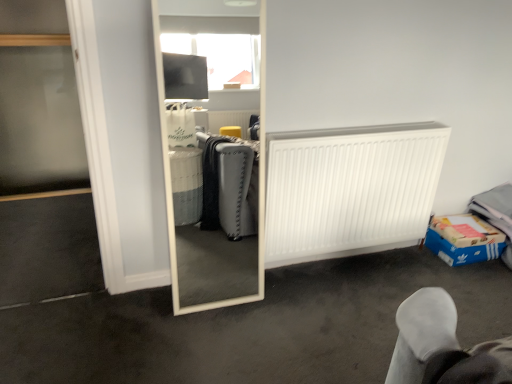
The width and height of the screenshot is (512, 384). In order to click on blue cardboard box at lower right in this screenshot , I will do `click(464, 239)`.

I want to click on white matte mirror at center, so click(252, 327).

Identify the location of white matte radiator at center right. The height and width of the screenshot is (384, 512). (350, 190).

This screenshot has height=384, width=512. Describe the element at coordinates (350, 190) in the screenshot. I see `white matte radiator at center right` at that location.

The width and height of the screenshot is (512, 384). I want to click on blue cardboard box at lower right, so click(464, 239).

Which of these two, blue cardboard box at lower right or white matte mirror at center, is bigger?

Bigger between the two is white matte mirror at center.

From a real-world perspective, between blue cardboard box at lower right and white matte mirror at center, who is vertically lower?

white matte mirror at center.

Is blue cardboard box at lower right shorter than white matte mirror at center?

Incorrect, the height of blue cardboard box at lower right does not fall short of that of white matte mirror at center.

Visually, is blue cardboard box at lower right positioned to the left or to the right of white matte mirror at center?

blue cardboard box at lower right is to the right of white matte mirror at center.

From a real-world perspective, between white matte mirror at center and white matte radiator at center right, who is vertically lower?

From a 3D spatial view, white matte mirror at center is below.

Based on the photo, between white matte mirror at center and white matte radiator at center right, which one has larger width?

With larger width is white matte mirror at center.

Can you tell me how much white matte mirror at center and white matte radiator at center right differ in facing direction?

white matte mirror at center and white matte radiator at center right are facing 179 degrees away from each other.

Is white matte mirror at center oriented towards white matte radiator at center right?

No, white matte mirror at center is not aimed at white matte radiator at center right.

Would you say white matte mirror at center contains blue cardboard box at lower right?

No, blue cardboard box at lower right is located outside of white matte mirror at center.

Considering the relative sizes of white matte mirror at center and blue cardboard box at lower right in the image provided, is white matte mirror at center wider than blue cardboard box at lower right?

Indeed, white matte mirror at center has a greater width compared to blue cardboard box at lower right.

How much distance is there between white matte mirror at center and blue cardboard box at lower right?

The distance of white matte mirror at center from blue cardboard box at lower right is 21.65 inches.

Is white matte mirror at center further to the viewer compared to blue cardboard box at lower right?

No, it is not.

Do you think white matte radiator at center right is within white matte mirror at center, or outside of it?

white matte radiator at center right is outside white matte mirror at center.

Is white matte radiator at center right looking in the opposite direction of white matte mirror at center?

white matte radiator at center right does not have its back to white matte mirror at center.

From a real-world perspective, which is physically below, white matte radiator at center right or white matte mirror at center?

white matte mirror at center, from a real-world perspective.

Considering the positions of points (283, 236) and (350, 310), is point (283, 236) closer to camera compared to point (350, 310)?

No, (283, 236) is further to viewer.

Locate an element on the screen. The image size is (512, 384). radiator above the blue cardboard box at lower right (from a real-world perspective) is located at coordinates (350, 190).

Would you consider white matte radiator at center right to be distant from blue cardboard box at lower right?

No, there isn't a large distance between white matte radiator at center right and blue cardboard box at lower right.

From a real-world perspective, which is physically below, white matte radiator at center right or blue cardboard box at lower right?

From a 3D spatial view, blue cardboard box at lower right is below.

Which of these two, white matte radiator at center right or blue cardboard box at lower right, stands shorter?

With less height is blue cardboard box at lower right.

From a real-world perspective, which is physically below, blue cardboard box at lower right or white matte radiator at center right?

blue cardboard box at lower right is physically lower.

Does blue cardboard box at lower right turn towards white matte radiator at center right?

No, blue cardboard box at lower right is not aimed at white matte radiator at center right.

Which is nearer, (471, 255) or (421, 205)?

Point (471, 255) is positioned farther from the camera compared to point (421, 205).

You are a GUI agent. You are given a task and a screenshot of the screen. Output one action in this format:
    pyautogui.click(x=<x>, y=<y>)
    Task: Click on the concrete on the left of blue cardboard box at lower right
    The width and height of the screenshot is (512, 384).
    Given the screenshot: What is the action you would take?
    pyautogui.click(x=252, y=327)

I want to click on radiator above the white matte mirror at center (from a real-world perspective), so click(x=350, y=190).

When comparing their distances from blue cardboard box at lower right, does white matte mirror at center or white matte radiator at center right seem closer?

white matte radiator at center right.

Looking at the image, which one is located further to blue cardboard box at lower right, white matte radiator at center right or white matte mirror at center?

white matte mirror at center.

Estimate the real-world distances between objects in this image. Which object is closer to white matte radiator at center right, white matte mirror at center or blue cardboard box at lower right?

Among the two, white matte mirror at center is located nearer to white matte radiator at center right.

Looking at the image, which one is located closer to white matte radiator at center right, blue cardboard box at lower right or white matte mirror at center?

Based on the image, white matte mirror at center appears to be nearer to white matte radiator at center right.

From the image, which object appears to be farther from white matte mirror at center, white matte radiator at center right or blue cardboard box at lower right?

blue cardboard box at lower right lies further to white matte mirror at center than the other object.

Estimate the real-world distances between objects in this image. Which object is further from white matte mirror at center, blue cardboard box at lower right or white matte radiator at center right?

blue cardboard box at lower right.

Where is `radiator between white matte mirror at center and blue cardboard box at lower right along the z-axis`? The height and width of the screenshot is (384, 512). radiator between white matte mirror at center and blue cardboard box at lower right along the z-axis is located at coordinates (350, 190).